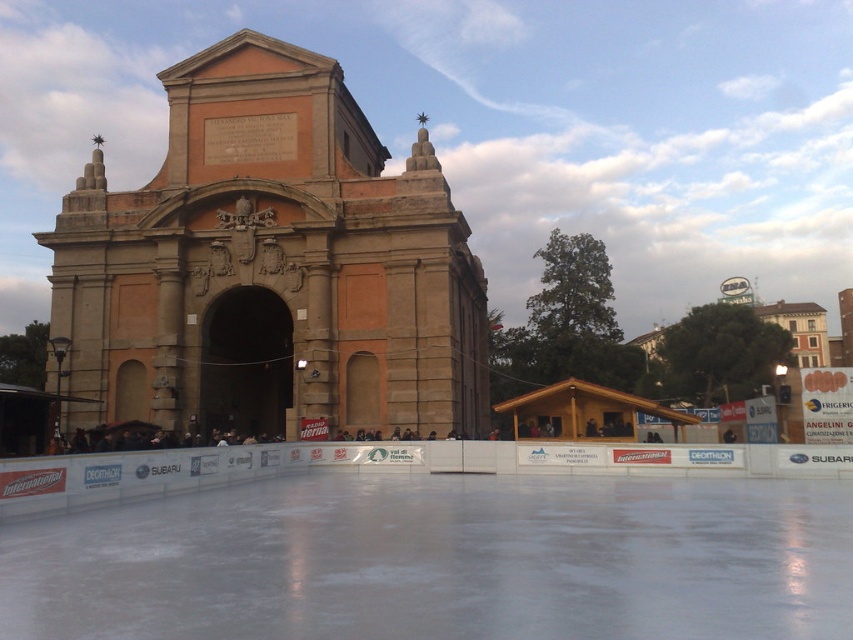
Question: Is brown stone church at center wider than white smooth ice at center?

Choices:
 (A) yes
 (B) no

Answer: (B)

Question: Among these objects, which one is nearest to the camera?

Choices:
 (A) brown stone church at center
 (B) white smooth ice at center

Answer: (B)

Question: Which point appears closest to the camera in this image?

Choices:
 (A) (840, 592)
 (B) (473, 380)

Answer: (A)

Question: Which of the following is the farthest from the observer?

Choices:
 (A) brown stone church at center
 (B) white smooth ice at center

Answer: (A)

Question: Is brown stone church at center below white smooth ice at center?

Choices:
 (A) yes
 (B) no

Answer: (B)

Question: Is brown stone church at center to the right of white smooth ice at center from the viewer's perspective?

Choices:
 (A) no
 (B) yes

Answer: (A)